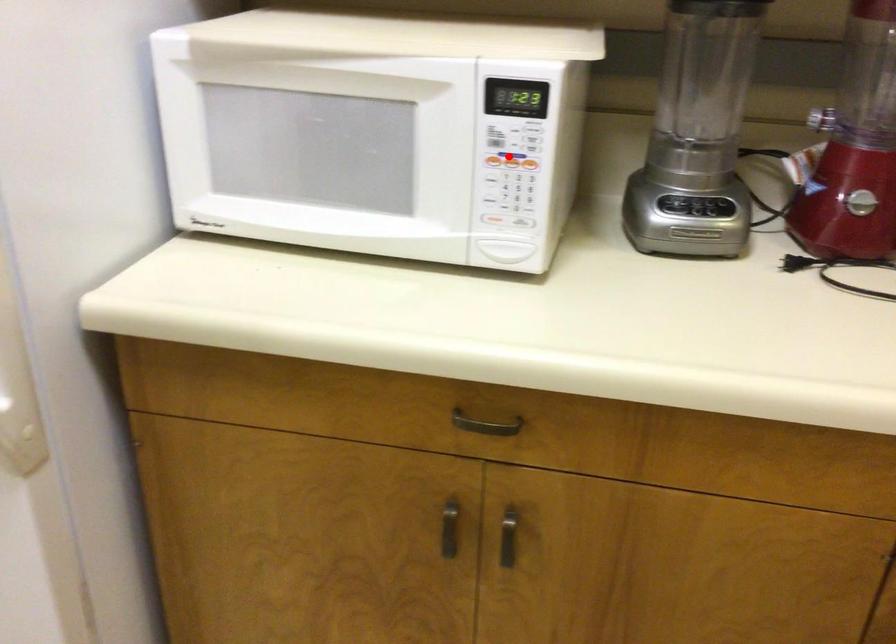
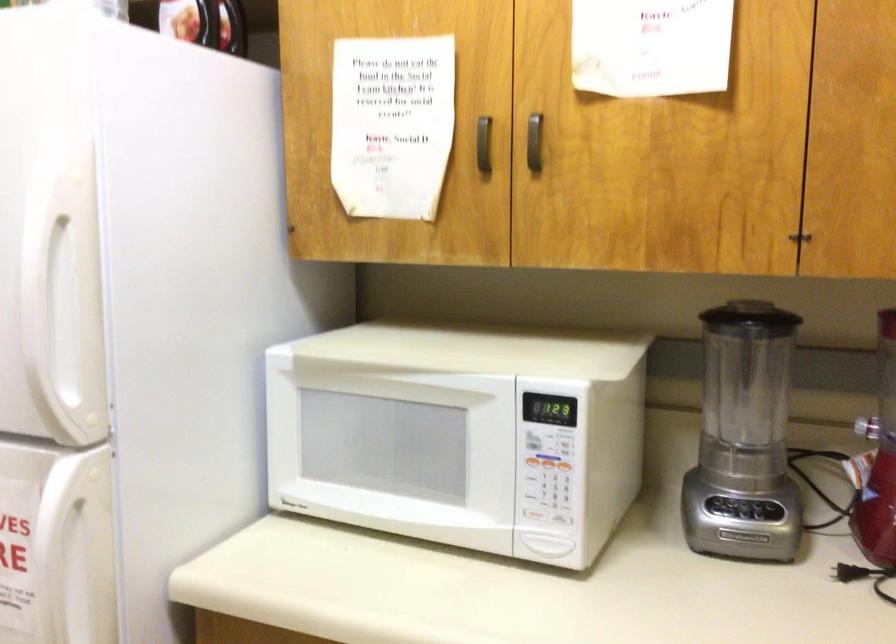
Question: I am providing you with two images of the same scene from different viewpoints. Given a red point in image1, look at the same physical point in image2. Is it:

Choices:
 (A) Closer to the viewpoint
 (B) Farther from the viewpoint

Answer: (B)